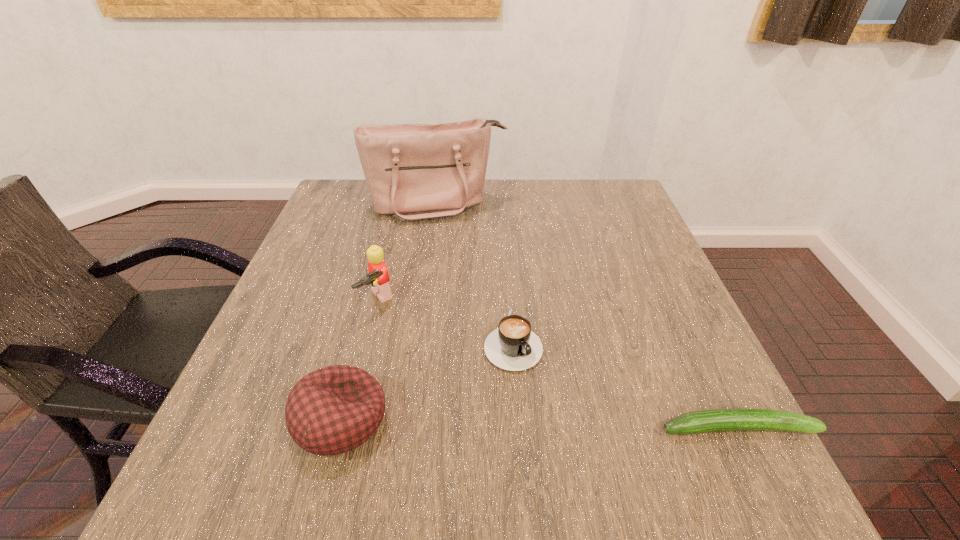
This screenshot has width=960, height=540. In order to click on the third closest object relative to the beanbag in this screenshot , I will do `click(703, 421)`.

You are a GUI agent. You are given a task and a screenshot of the screen. Output one action in this format:
    pyautogui.click(x=<x>, y=<y>)
    Task: Click on the object that is the third closest to the Lego
    The image size is (960, 540).
    Given the screenshot: What is the action you would take?
    pyautogui.click(x=414, y=172)

Identify the location of vacant space that satisfies the following two spatial constraints: 1. on the front side of the fourth shortest object; 2. on the left side of the cappuccino. This screenshot has width=960, height=540. (369, 339).